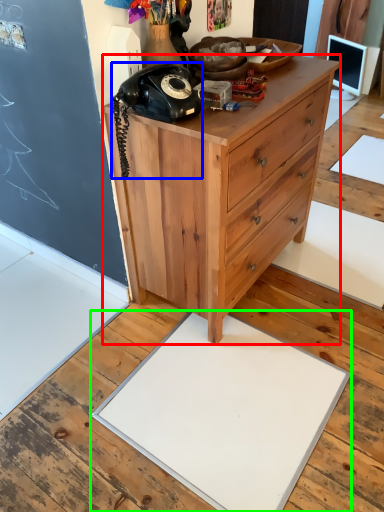
Question: Which object is positioned farthest from chest of drawers (highlighted by a red box)? Select from corded phone (highlighted by a blue box) and slate (highlighted by a green box).

Choices:
 (A) corded phone
 (B) slate

Answer: (B)